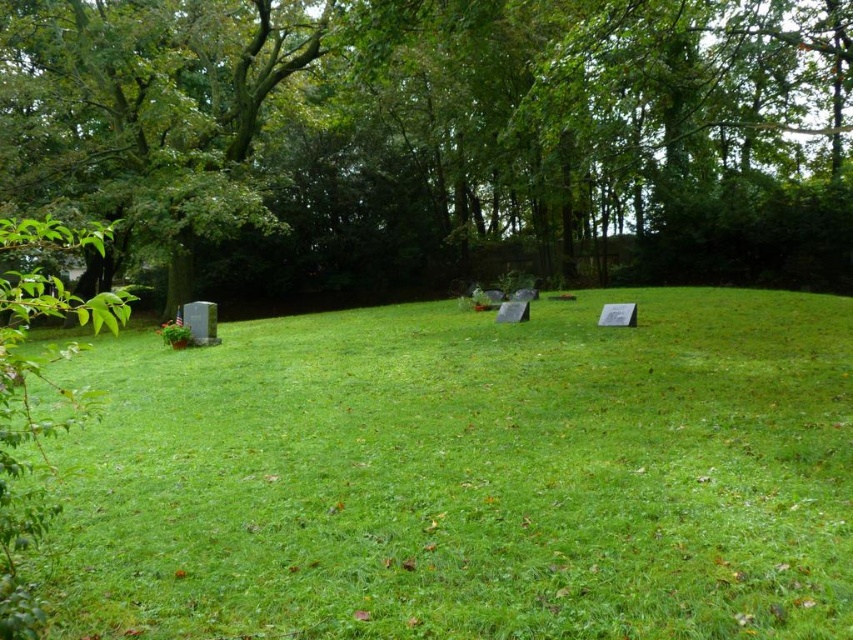
Does green grass at center have a lesser height compared to green leafy tree at upper left?

Indeed, green grass at center has a lesser height compared to green leafy tree at upper left.

Between point (827, 547) and point (265, 188), which one is positioned in front?

Point (827, 547)

Find the location of `green grass at center`. green grass at center is located at coordinates (468, 476).